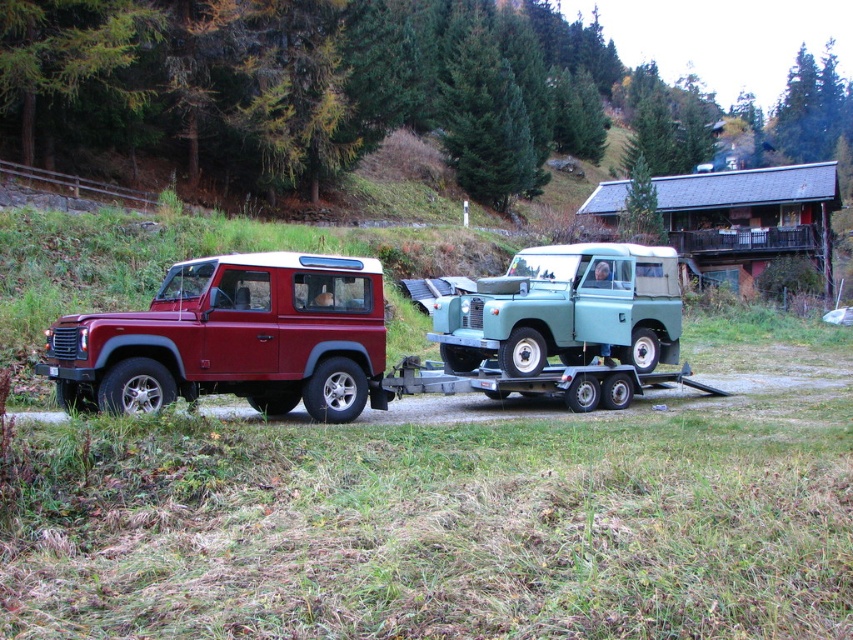
Question: Does matte red tow truck at left have a greater width compared to light green matte jeep at center?

Choices:
 (A) yes
 (B) no

Answer: (A)

Question: Among these points, which one is farthest from the camera?

Choices:
 (A) (355, 272)
 (B) (554, 253)

Answer: (B)

Question: Is matte red tow truck at left to the right of light green matte jeep at center from the viewer's perspective?

Choices:
 (A) yes
 (B) no

Answer: (B)

Question: Is matte red tow truck at left closer to camera compared to light green matte jeep at center?

Choices:
 (A) no
 (B) yes

Answer: (B)

Question: Which of the following is the farthest from the observer?

Choices:
 (A) (595, 275)
 (B) (102, 365)

Answer: (A)

Question: Which object appears closest to the camera in this image?

Choices:
 (A) light green matte jeep at center
 (B) matte red tow truck at left

Answer: (B)